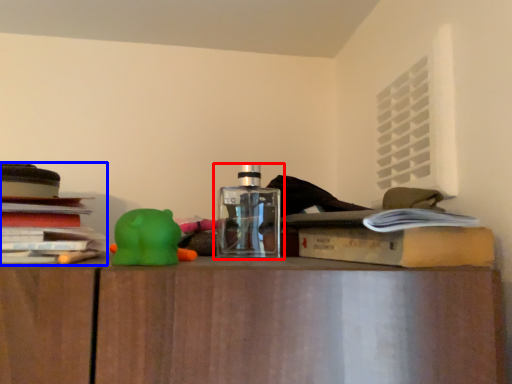
Question: Which of the following is the farthest to the observer, bottle (highlighted by a red box) or book (highlighted by a blue box)?

Choices:
 (A) bottle
 (B) book

Answer: (A)